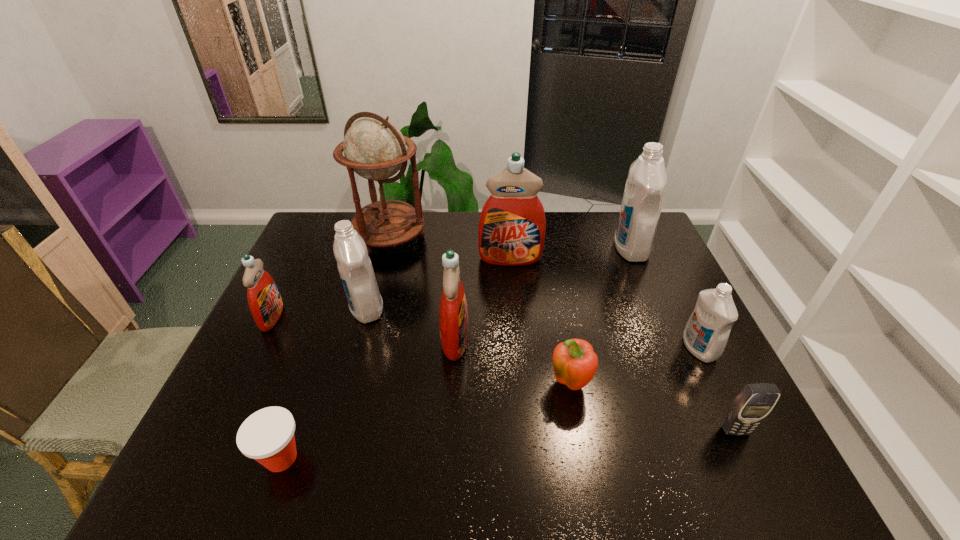
The height and width of the screenshot is (540, 960). Find the location of `free space located on the front surface of the sixth object from right to left`. free space located on the front surface of the sixth object from right to left is located at coordinates (494, 339).

Locate an element on the screen. The height and width of the screenshot is (540, 960). vacant space positioned 0.060m on the left of the nearest white detergent is located at coordinates (661, 349).

This screenshot has height=540, width=960. I want to click on free spot located on the front surface of the smallest red detergent, so click(306, 317).

This screenshot has width=960, height=540. In order to click on blank area located on the right of the orange pepper in this screenshot , I will do `click(630, 386)`.

At what (x,y) coordinates should I click in order to perform the action: click on free space located 0.070m on the front face of the cellular telephone. Please return your answer as a coordinate pair (x, y). The height and width of the screenshot is (540, 960). Looking at the image, I should click on (753, 468).

Image resolution: width=960 pixels, height=540 pixels. Find the location of `free space located 0.090m on the right of the shortest object`. free space located 0.090m on the right of the shortest object is located at coordinates (348, 458).

I want to click on globe present at the far edge, so click(374, 148).

This screenshot has width=960, height=540. In order to click on object at the near edge in this screenshot , I will do `click(267, 436)`.

Find the location of a particular element. The height and width of the screenshot is (540, 960). detergent situated at the left edge is located at coordinates (265, 303).

Find the location of a particular element. This screenshot has height=540, width=960. Dixie cup at the left edge is located at coordinates (267, 436).